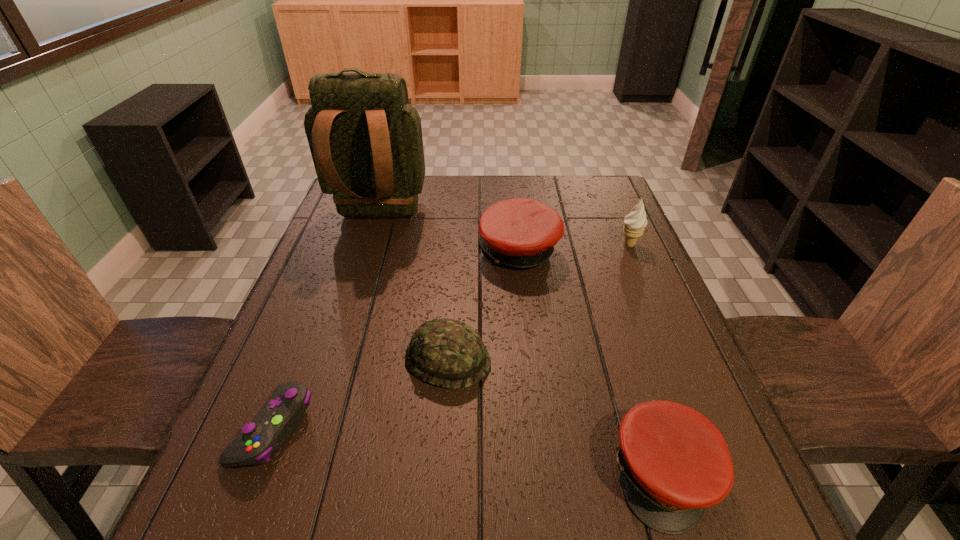
The image size is (960, 540). Find the location of `the tallest object`. the tallest object is located at coordinates (365, 139).

Where is `the fifth shortest object`? Image resolution: width=960 pixels, height=540 pixels. the fifth shortest object is located at coordinates tap(634, 224).

Locate an element on the screen. The width and height of the screenshot is (960, 540). the farthest cap is located at coordinates (521, 233).

I want to click on the second nearest cap, so click(448, 353).

Find the location of `the rightmost cap`. the rightmost cap is located at coordinates (674, 462).

At what (x,y) coordinates should I click in order to perform the action: click on control. Please return your answer as a coordinate pair (x, y). Looking at the image, I should click on (271, 429).

You are a GUI agent. You are given a task and a screenshot of the screen. Output one action in this format:
    pyautogui.click(x=<x>, y=<y>)
    Task: Click on the free space located on the back of the backpack
    
    Given the screenshot: What is the action you would take?
    click(x=359, y=281)

Identify the location of free space located on the front-facing side of the second tallest object. Image resolution: width=960 pixels, height=540 pixels. (531, 245).

Identify the location of vacant space situated 0.330m on the front-facing side of the second tallest object. Image resolution: width=960 pixels, height=540 pixels. (498, 245).

Locate an element on the screen. The image size is (960, 540). vacant space situated 0.200m on the front-facing side of the second tallest object is located at coordinates (545, 245).